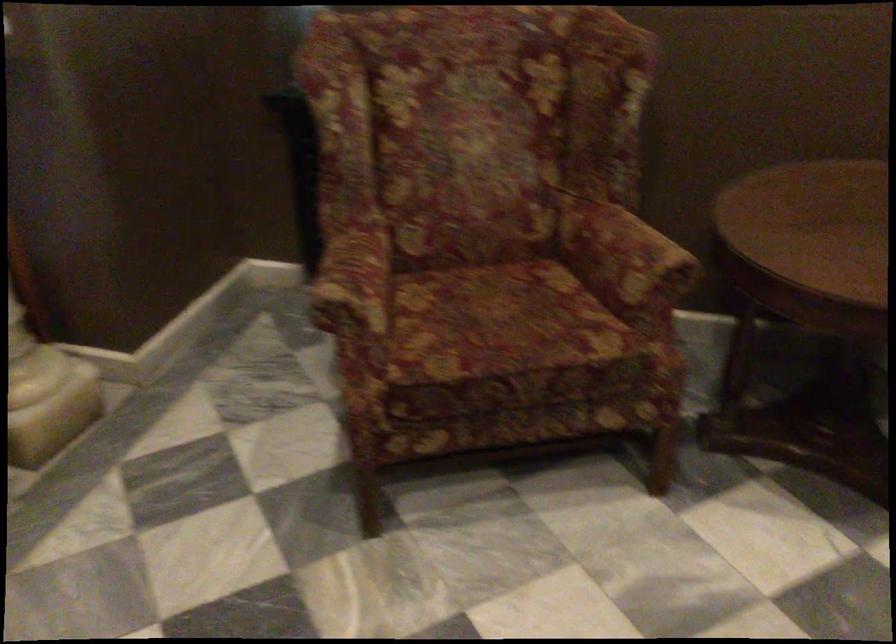
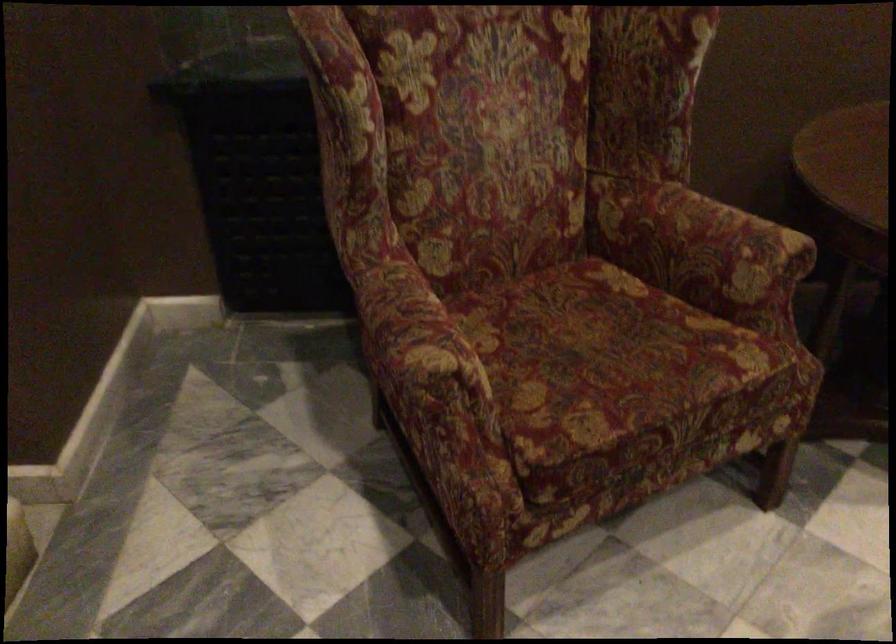
Locate, in the second image, the point that corresponds to (x=326, y=301) in the first image.

(428, 377)